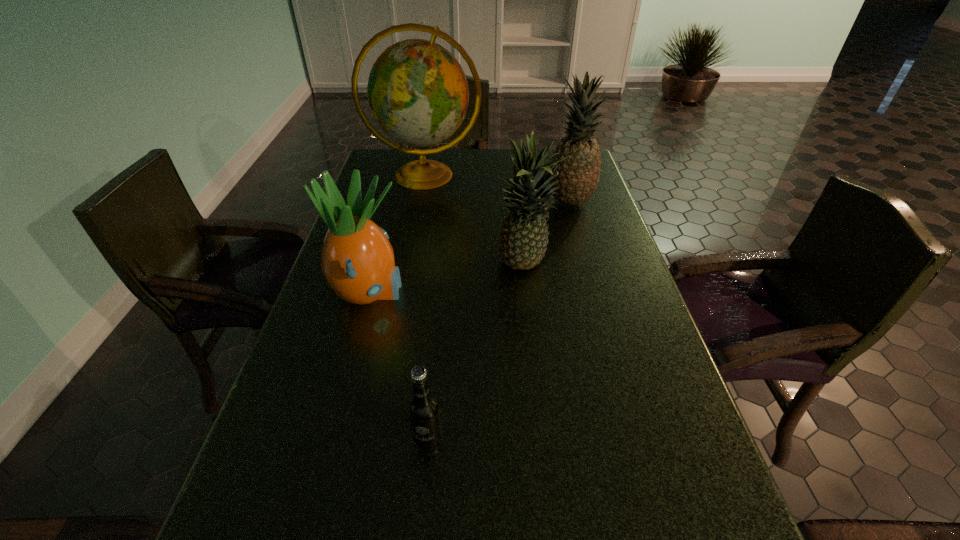
Locate an element on the screen. free space located on the front of the fourth object from left to right is located at coordinates (543, 421).

Where is `vacant space located 0.100m at the entrance of the fourth tallest object`? Image resolution: width=960 pixels, height=540 pixels. vacant space located 0.100m at the entrance of the fourth tallest object is located at coordinates (448, 293).

Where is `vacant region located on the label of the nearest object`? Image resolution: width=960 pixels, height=540 pixels. vacant region located on the label of the nearest object is located at coordinates (422, 502).

The image size is (960, 540). I want to click on object that is at the far edge, so click(418, 93).

Where is `globe at the left edge`? The width and height of the screenshot is (960, 540). globe at the left edge is located at coordinates (418, 93).

Where is `pineapple located at the left edge`? pineapple located at the left edge is located at coordinates click(357, 260).

At what (x,y) coordinates should I click in order to perform the action: click on object at the right edge. Please return your answer as a coordinate pair (x, y). The width and height of the screenshot is (960, 540). Looking at the image, I should click on (578, 176).

Locate an element on the screen. object that is at the far left corner is located at coordinates (418, 93).

Locate an element on the screen. Image resolution: width=960 pixels, height=540 pixels. vacant space at the far edge of the desktop is located at coordinates (468, 158).

This screenshot has width=960, height=540. Find the location of `free location at the left edge of the desktop`. free location at the left edge of the desktop is located at coordinates (299, 346).